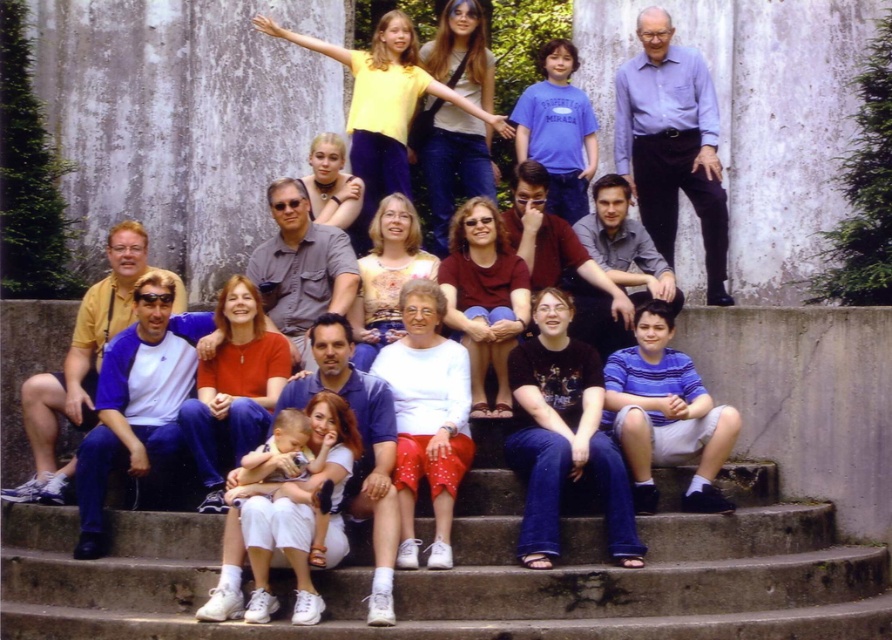
You are a photographer trying to capture a group photo. You notice the concrete stairs at lower center and the blue shirt at upper right. Which object is shorter in height?

The concrete stairs at lower center has a lesser height compared to the blue shirt at upper right, so the concrete stairs at lower center is shorter in height.

You are standing at the bottom of the concrete stairs at lower center and want to take a photo of the white cotton shirt at center. Which object is closer to you when you look through your camera?

The concrete stairs at lower center are closer to you than the white cotton shirt at center, so the concrete stairs will appear closer in your camera view.

You are standing at the bottom of the staircase and want to take a photo of the group on the concrete stairs at lower center. Based on their position, where should you position yourself to ensure they are fully visible in the frame?

Since the concrete stairs at lower center is located at point (476, 573), you should position yourself slightly to the right and lower down to capture the entire group in the frame.